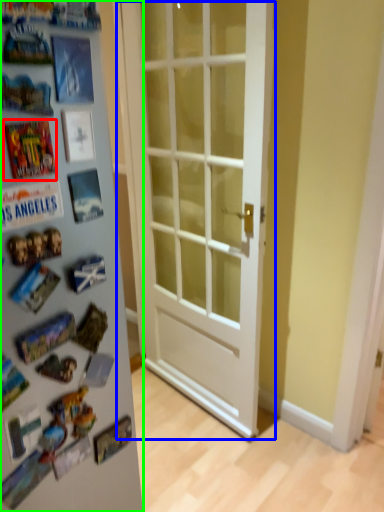
Question: Estimate the real-world distances between objects in this image. Which object is closer to comic book (highlighted by a red box), door (highlighted by a blue box) or fridge (highlighted by a green box)?

Choices:
 (A) door
 (B) fridge

Answer: (B)